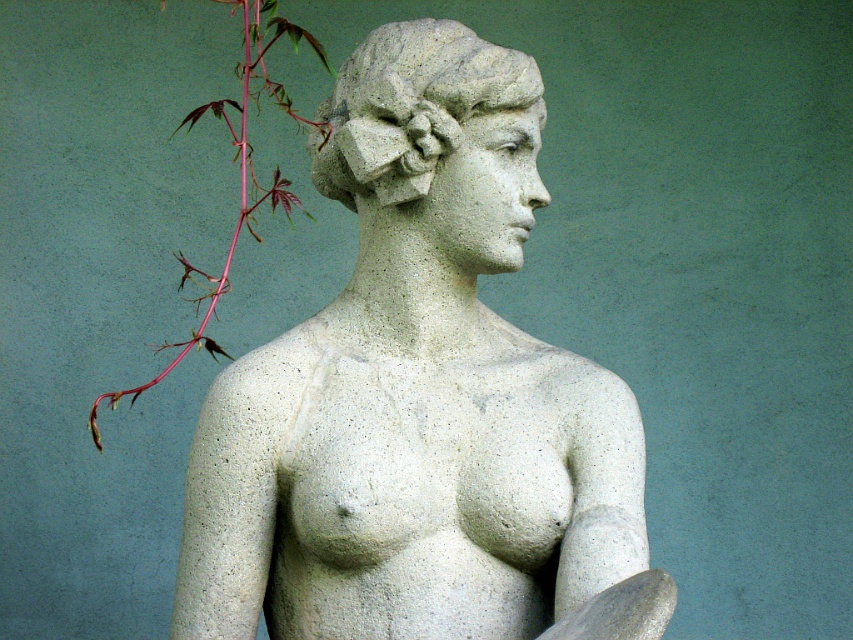
This screenshot has height=640, width=853. What do you see at coordinates (412, 108) in the screenshot?
I see `gray stone head at center` at bounding box center [412, 108].

Who is positioned more to the left, gray stone head at center or pink stem at left?

pink stem at left is more to the left.

Is point (383, 84) positioned behind point (97, 432)?

No, it is in front of (97, 432).

At what (x,y) coordinates should I click in order to perform the action: click on gray stone head at center. Please return your answer as a coordinate pair (x, y). Looking at the image, I should click on (412, 108).

Which is behind, point (196, 556) or point (252, 20)?

Point (252, 20)

Is white stone statue at center below pink stem at left?

Yes.

Between point (641, 589) and point (119, 397), which one is positioned behind?

Point (119, 397)

Locate an element on the screen. The image size is (853, 640). white stone statue at center is located at coordinates (421, 397).

In the scene shown: Does white stone statue at center have a larger size compared to gray stone head at center?

Yes, white stone statue at center is bigger than gray stone head at center.

Is point (469, 65) closer to camera compared to point (514, 83)?

Yes, point (469, 65) is in front of point (514, 83).

Which is behind, point (485, 346) or point (341, 132)?

The point (485, 346) is more distant.

Where is `white stone statue at center`? This screenshot has width=853, height=640. white stone statue at center is located at coordinates (421, 397).